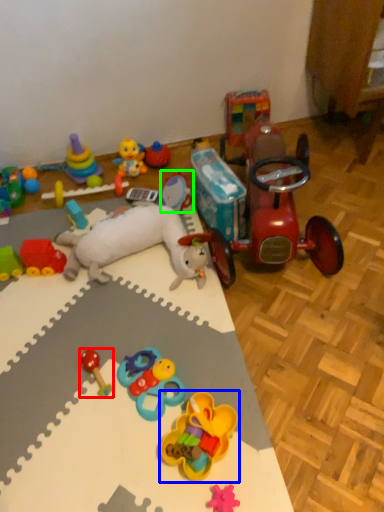
Question: Estimate the real-world distances between objects in this image. Which object is farther from toy (highlighted by a red box), toy (highlighted by a blue box) or toy (highlighted by a green box)?

Choices:
 (A) toy
 (B) toy

Answer: (B)